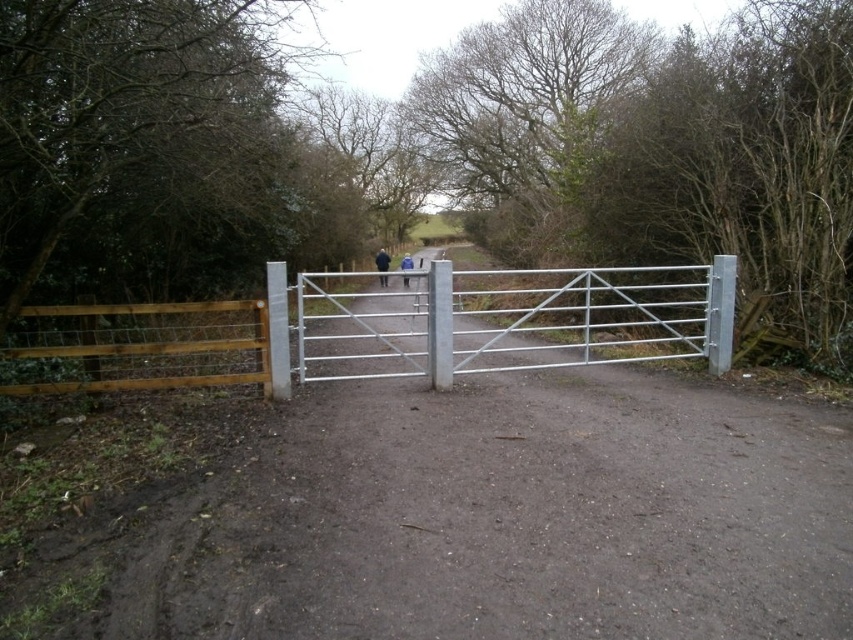
Does black fabric jacket at center appear on the right side of blue fabric jacket at center?

Incorrect, black fabric jacket at center is not on the right side of blue fabric jacket at center.

Where is `black fabric jacket at center`? black fabric jacket at center is located at coordinates (381, 260).

You are a GUI agent. You are given a task and a screenshot of the screen. Output one action in this format:
    pyautogui.click(x=<x>, y=<y>)
    Task: Click on the black fabric jacket at center
    The height and width of the screenshot is (640, 853).
    Given the screenshot: What is the action you would take?
    pyautogui.click(x=381, y=260)

Between silver/galvanized metal gate at center and black fabric jacket at center, which one is positioned lower?

silver/galvanized metal gate at center is below.

Is point (412, 376) positioned before point (383, 278)?

That is True.

Where is `silver/galvanized metal gate at center`? The width and height of the screenshot is (853, 640). silver/galvanized metal gate at center is located at coordinates (514, 321).

Where is `silver/galvanized metal gate at center`? silver/galvanized metal gate at center is located at coordinates (514, 321).

Can you confirm if silver/galvanized metal gate at center is positioned to the right of blue fabric jacket at center?

Indeed, silver/galvanized metal gate at center is positioned on the right side of blue fabric jacket at center.

Between silver/galvanized metal gate at center and blue fabric jacket at center, which one appears on the left side from the viewer's perspective?

Positioned to the left is blue fabric jacket at center.

Identify the location of silver/galvanized metal gate at center. (514, 321).

Locate an element on the screen. silver/galvanized metal gate at center is located at coordinates (514, 321).